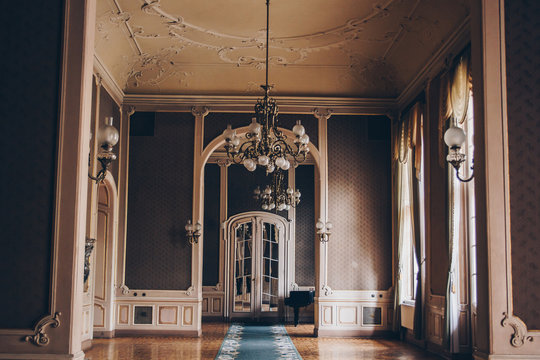
The width and height of the screenshot is (540, 360). Identify the location of chandeliers. (275, 164), (276, 196).